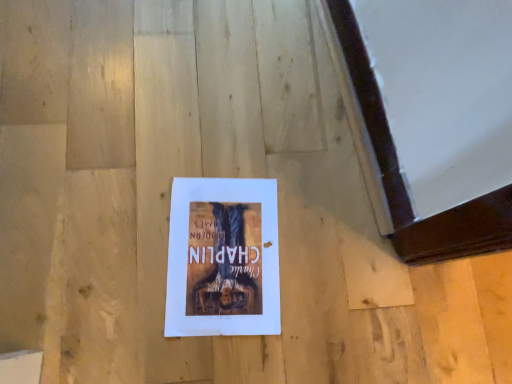
The width and height of the screenshot is (512, 384). I want to click on free space above white paper at center (from a real-world perspective), so click(218, 250).